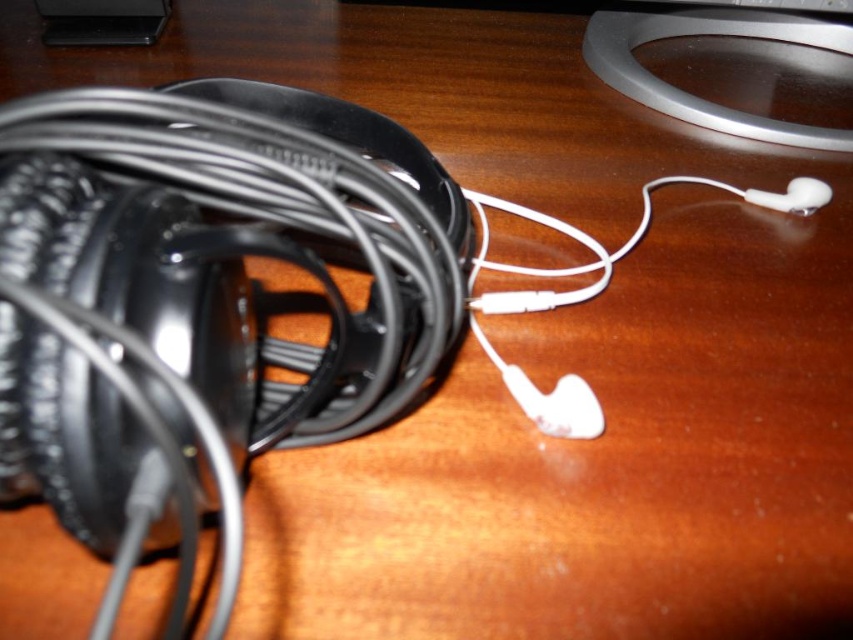
Who is lower down, black matte wire at left or white matte earphone at center-right?

black matte wire at left is below.

Is point (276, 436) in front of point (827, 200)?

That is True.

Does point (408, 132) come closer to viewer compared to point (753, 188)?

Yes, point (408, 132) is closer to viewer.

Identify the location of black matte wire at left. (236, 243).